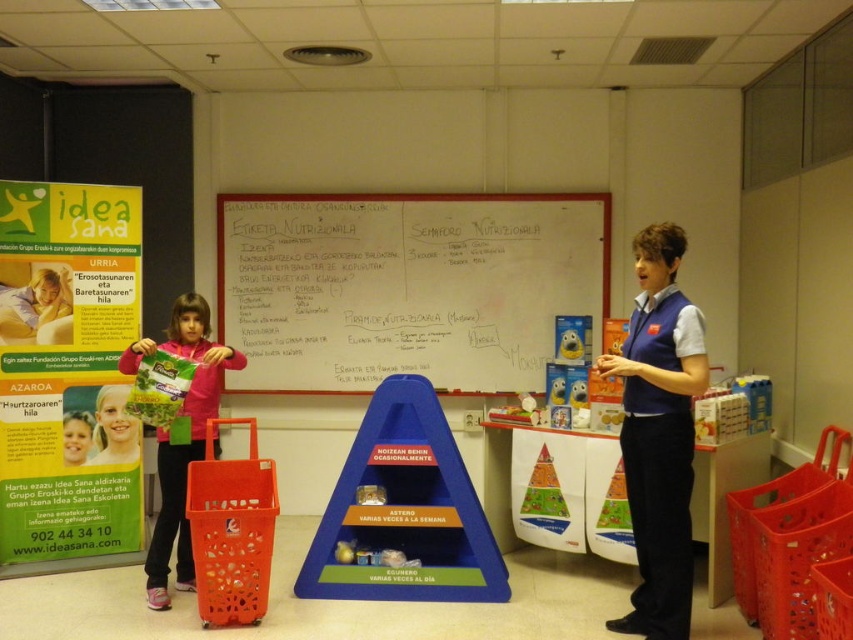
How much distance is there between blue uniform at center and matte pink jacket at left?

blue uniform at center is 6.22 feet away from matte pink jacket at left.

Based on the photo, can you confirm if blue uniform at center is wider than matte pink jacket at left?

No, blue uniform at center is not wider than matte pink jacket at left.

Identify the location of blue uniform at center. The image size is (853, 640). (659, 433).

Locate an element on the screen. The height and width of the screenshot is (640, 853). blue uniform at center is located at coordinates (659, 433).

Can you confirm if green paper poster at upper left is smaller than smooth pink shirt at lower left?

No.

Between green paper poster at upper left and smooth pink shirt at lower left, which one has more height?

Standing taller between the two is green paper poster at upper left.

Locate an element on the screen. green paper poster at upper left is located at coordinates (67, 369).

Does whiteboard at center have a smaller size compared to smooth pink shirt at lower left?

Incorrect, whiteboard at center is not smaller in size than smooth pink shirt at lower left.

Which is below, whiteboard at center or smooth pink shirt at lower left?

smooth pink shirt at lower left

Describe the element at coordinates (405, 285) in the screenshot. I see `whiteboard at center` at that location.

Find the location of a particular element. whiteboard at center is located at coordinates (405, 285).